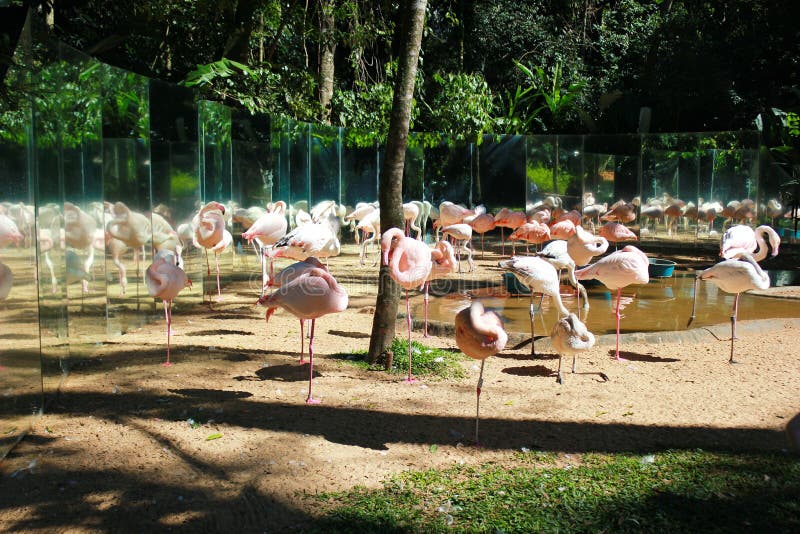
Identify the location of mirror wall on left side of pen. The height and width of the screenshot is (534, 800). (117, 193), (317, 175).